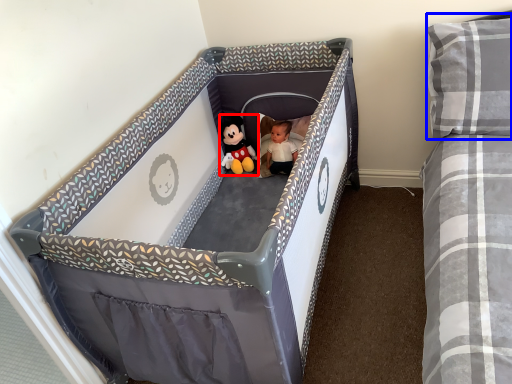
Question: Which point is further to the camera, toy (highlighted by a red box) or pillow (highlighted by a blue box)?

Choices:
 (A) toy
 (B) pillow

Answer: (A)